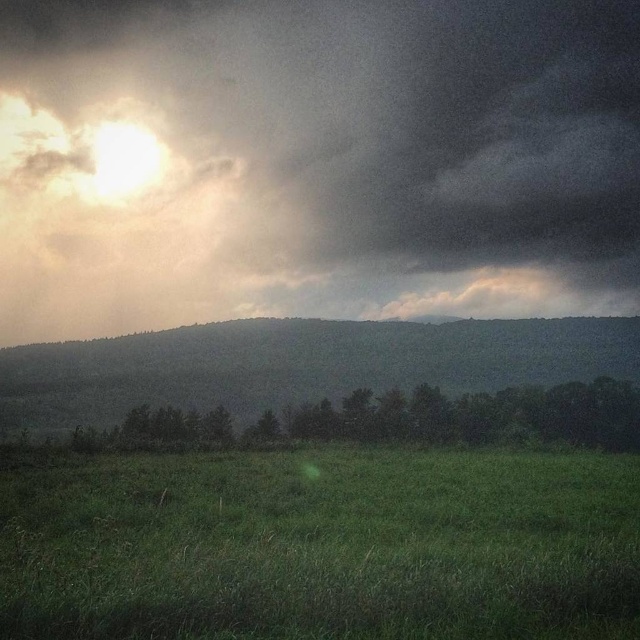
Question: Which object is positioned closest to the green grassy field at lower center?

Choices:
 (A) dark cloudy sky at upper center
 (B) green leafy trees at center

Answer: (B)

Question: Does dark cloudy sky at upper center lie behind green leafy trees at center?

Choices:
 (A) yes
 (B) no

Answer: (A)

Question: Which of the following is the farthest from the observer?

Choices:
 (A) (72, 545)
 (B) (420, 234)

Answer: (B)

Question: Does green grassy hillside at center appear on the left side of green leafy trees at center?

Choices:
 (A) yes
 (B) no

Answer: (A)

Question: Which object appears closest to the camera in this image?

Choices:
 (A) green leafy trees at center
 (B) dark cloudy sky at upper center

Answer: (A)

Question: Does dark cloudy sky at upper center have a greater width compared to green grassy hillside at center?

Choices:
 (A) no
 (B) yes

Answer: (B)